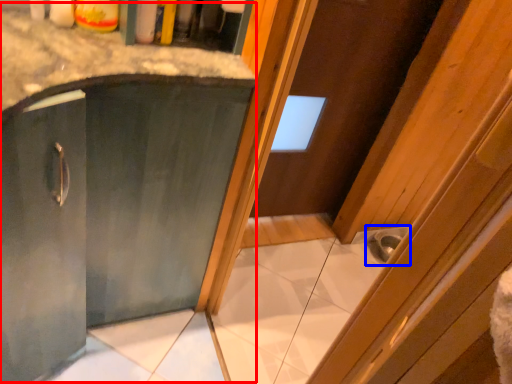
Question: Which of the following is the farthest to the observer, cabinetry (highlighted by a red box) or sink (highlighted by a blue box)?

Choices:
 (A) cabinetry
 (B) sink

Answer: (B)